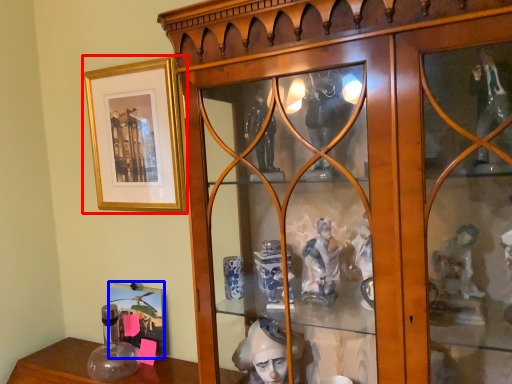
Question: Which object appears closest to the camera in this image, picture frame (highlighted by a red box) or picture frame (highlighted by a blue box)?

Choices:
 (A) picture frame
 (B) picture frame

Answer: (A)